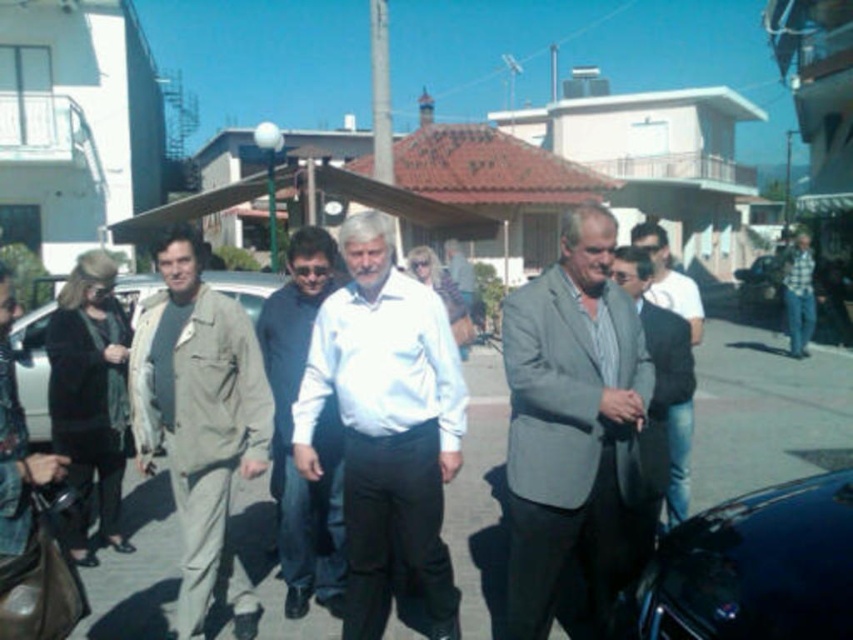
Does beige fabric jacket at left appear on the right side of khaki cotton jacket at left?

No, beige fabric jacket at left is not to the right of khaki cotton jacket at left.

This screenshot has height=640, width=853. Identify the location of beige fabric jacket at left. (33, 371).

Who is shorter, white smooth shirt at center or beige fabric jacket at left?

beige fabric jacket at left is shorter.

Is point (426, 515) positioned in front of point (45, 440)?

Yes, point (426, 515) is in front of point (45, 440).

Locate an element on the screen. white smooth shirt at center is located at coordinates (386, 426).

In the scene shown: Can you confirm if beige fabric jacket at left is positioned to the right of denim jeans at right?

Incorrect, beige fabric jacket at left is not on the right side of denim jeans at right.

Which is above, beige fabric jacket at left or denim jeans at right?

denim jeans at right is above.

You are a GUI agent. You are given a task and a screenshot of the screen. Output one action in this format:
    pyautogui.click(x=<x>, y=<y>)
    Task: Click on the beige fabric jacket at left
    
    Given the screenshot: What is the action you would take?
    pyautogui.click(x=33, y=371)

Where is `beige fabric jacket at left`? This screenshot has width=853, height=640. beige fabric jacket at left is located at coordinates (33, 371).